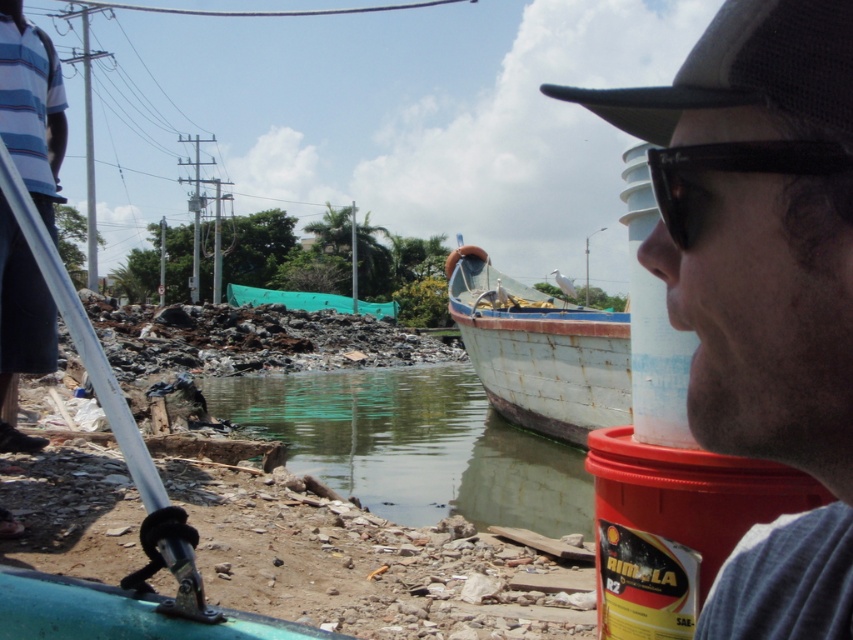
Does green murky water at lower center come in front of rusty metal boat at center?

Yes, green murky water at lower center is in front of rusty metal boat at center.

Does green murky water at lower center have a greater width compared to rusty metal boat at center?

Yes, green murky water at lower center is wider than rusty metal boat at center.

Measure the distance between point (355, 388) and camera.

Point (355, 388) is 24.86 meters away from camera.

At what (x,y) coordinates should I click in order to perform the action: click on green murky water at lower center. Please return your answer as a coordinate pair (x, y). The image size is (853, 640). Looking at the image, I should click on (413, 445).

Is matte black cap at upper right positioned behind rusty metal boat at center?

No, it is not.

Is matte black cap at upper right taller than rusty metal boat at center?

No.

Between point (764, 113) and point (460, 282), which one is positioned in front?

Positioned in front is point (764, 113).

I want to click on matte black cap at upper right, so click(761, 282).

Looking at this image, who is more distant from viewer, (556, 412) or (729, 170)?

The point (556, 412) is more distant.

Which is above, rusty metal boat at center or black ray-ban sunglasses at upper right?

black ray-ban sunglasses at upper right is above.

Who is more forward, (599, 310) or (831, 154)?

Point (831, 154)

Where is `rusty metal boat at center`? This screenshot has width=853, height=640. rusty metal boat at center is located at coordinates (538, 352).